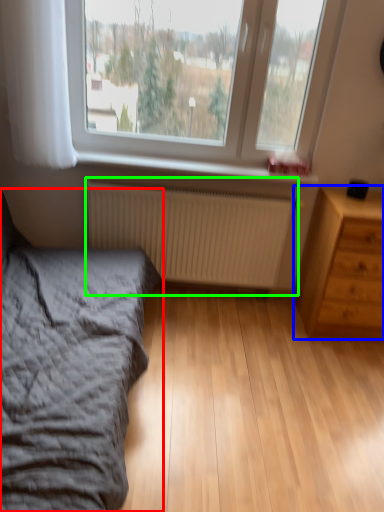
Question: Which object is the closest to the bed (highlighted by a red box)? Choose among these: chest of drawers (highlighted by a blue box) or radiator (highlighted by a green box).

Choices:
 (A) chest of drawers
 (B) radiator

Answer: (B)